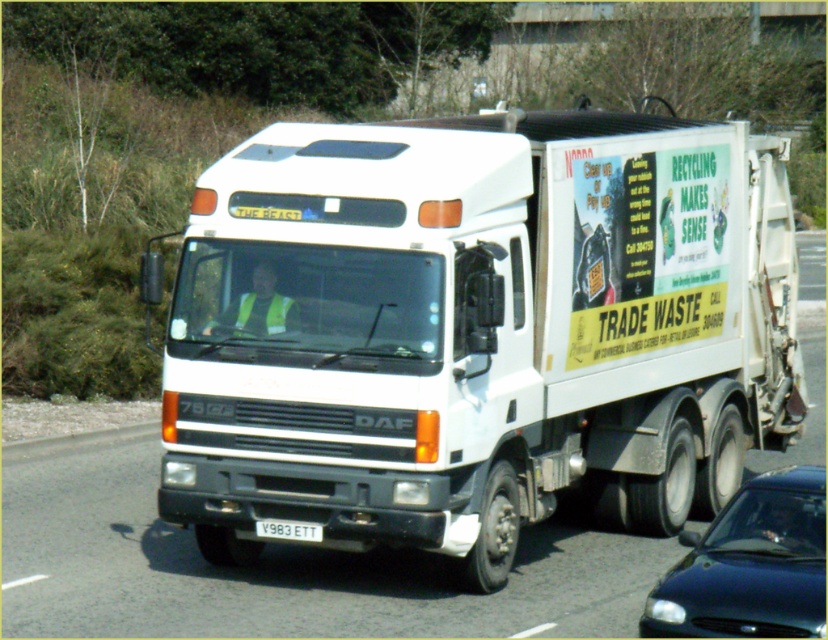
You are a pedestrian standing on the sidewalk. You see a point at coordinate point (477, 330). What object is this point located on?

The point (477, 330) is located on the white matte truck at center.

You are a traffic officer observing a white matte truck at center with a white plastic license plate at center. Can you see the license plate clearly?

The white matte truck at center is positioned over white plastic license plate at center, so the license plate is covered and cannot be seen clearly.